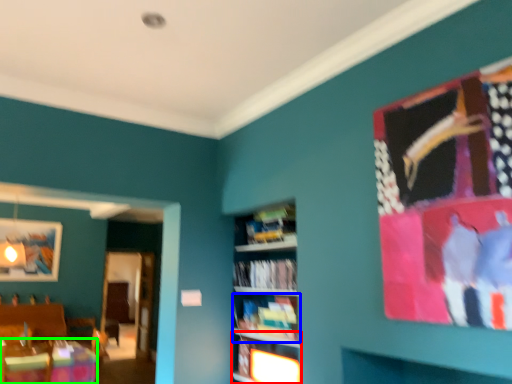
Question: Estimate the real-world distances between objects in this image. Which object is farther from shelf (highlighted by a red box), book (highlighted by a blue box) or table (highlighted by a green box)?

Choices:
 (A) book
 (B) table

Answer: (B)